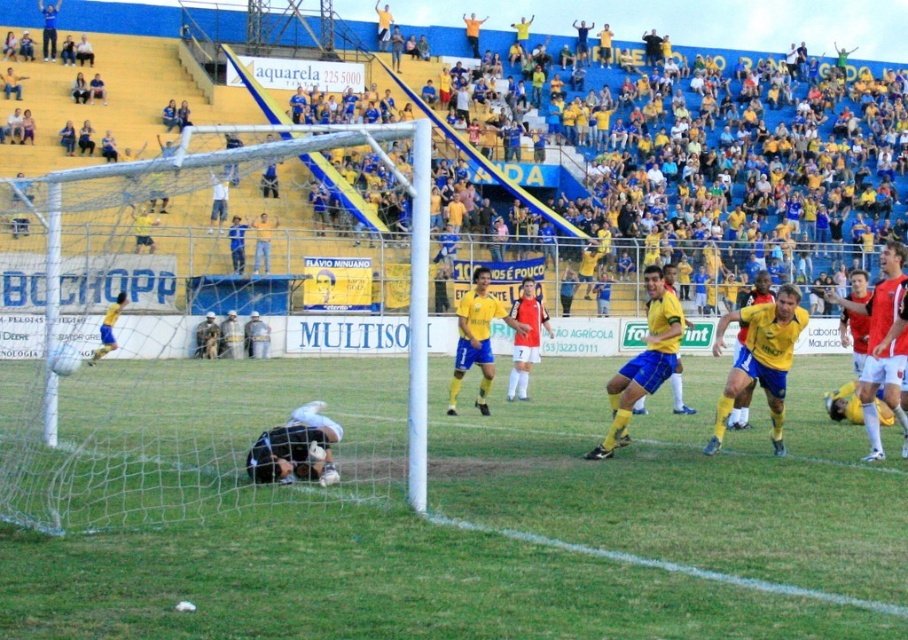
Who is higher up, yellow matte jersey at center or dark blue jersey at lower center?

yellow matte jersey at center is above.

Can you confirm if yellow matte jersey at center is positioned to the right of dark blue jersey at lower center?

Correct, you'll find yellow matte jersey at center to the right of dark blue jersey at lower center.

Describe the element at coordinates (800, 340) in the screenshot. The height and width of the screenshot is (640, 908). I see `yellow matte jersey at center` at that location.

Find the location of a particular element. The width and height of the screenshot is (908, 640). yellow matte jersey at center is located at coordinates (800, 340).

Which is behind, point (569, 259) or point (498, 589)?

Positioned behind is point (569, 259).

Which is more to the right, yellow jersey at center or green grass at center?

yellow jersey at center

Measure the distance between point (125, 259) and camera.

Point (125, 259) and camera are 96.00 feet apart from each other.

Locate an element on the screen. The width and height of the screenshot is (908, 640). yellow jersey at center is located at coordinates (546, 150).

Is yellow jersey at center smaller than yellow matte jersey at center?

No, yellow jersey at center is not smaller than yellow matte jersey at center.

Can you confirm if yellow jersey at center is taller than yellow matte jersey at center?

Yes, yellow jersey at center is taller than yellow matte jersey at center.

Measure the distance between yellow jersey at center and camera.

The distance of yellow jersey at center from camera is 8.88 meters.

Locate an element on the screen. The image size is (908, 640). yellow jersey at center is located at coordinates (546, 150).